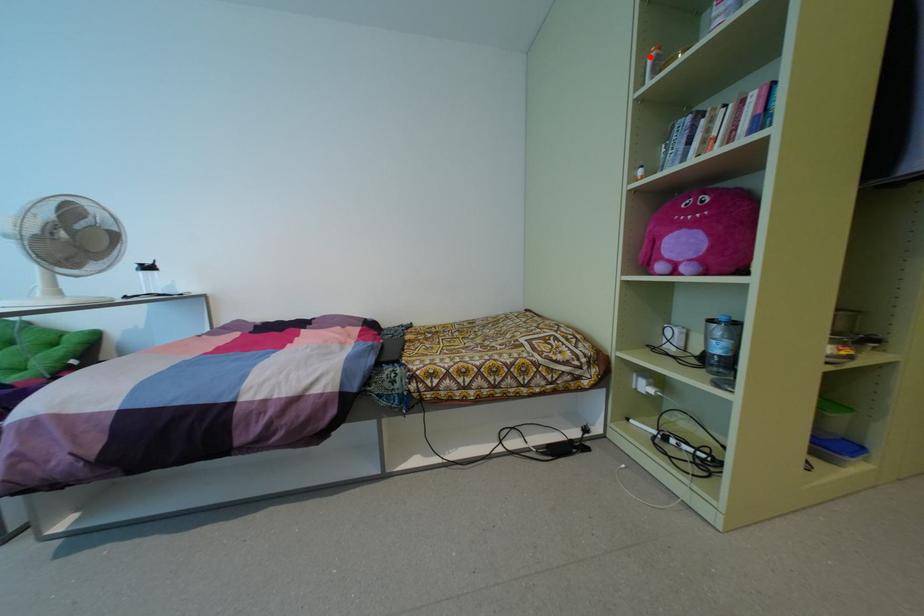
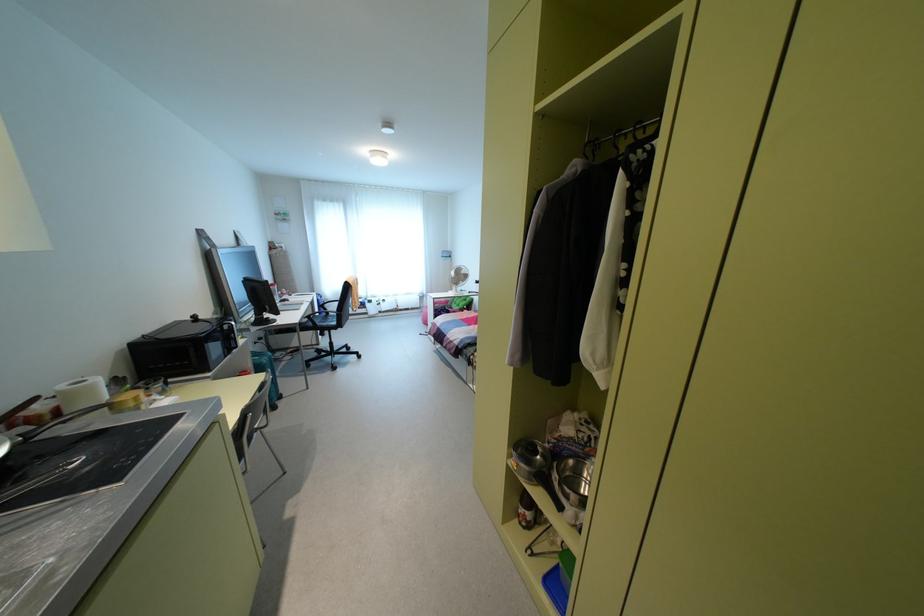
Question: I am providing you with two images of the same scene from different viewpoints. A red point is marked on the first image. Can you still see the location of the red point in image 2?

Choices:
 (A) Yes
 (B) No

Answer: (B)